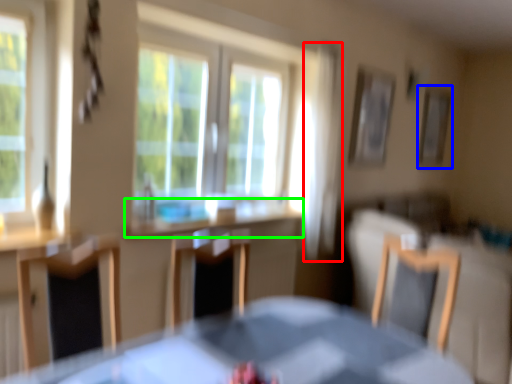
Question: Considering the real-world distances, which object is farthest from curtain (highlighted by a red box)? picture frame (highlighted by a blue box) or counter top (highlighted by a green box)?

Choices:
 (A) picture frame
 (B) counter top

Answer: (A)